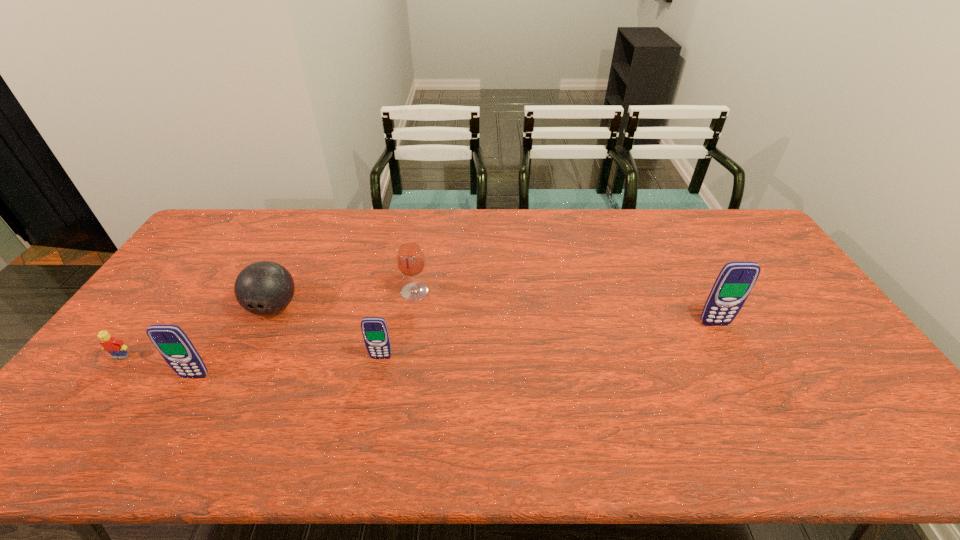
The width and height of the screenshot is (960, 540). Find the location of `the nearest cellular telephone`. the nearest cellular telephone is located at coordinates (171, 341).

Find the location of a particular element. Image resolution: width=960 pixels, height=540 pixels. the leftmost cellular telephone is located at coordinates (171, 341).

The image size is (960, 540). I want to click on the second cellular telephone from left to right, so click(x=375, y=332).

I want to click on the shortest cellular telephone, so click(375, 332).

Find the location of a particular element. The width and height of the screenshot is (960, 540). the tallest cellular telephone is located at coordinates (735, 281).

The image size is (960, 540). Identify the location of the farthest cellular telephone. (735, 281).

Locate an element on the screen. The image size is (960, 540). wineglass is located at coordinates (410, 258).

Find the location of a particular element. This screenshot has width=960, height=540. Lego is located at coordinates (117, 349).

Locate an element on the screen. the leftmost object is located at coordinates 117,349.

I want to click on bowling ball, so click(x=263, y=288).